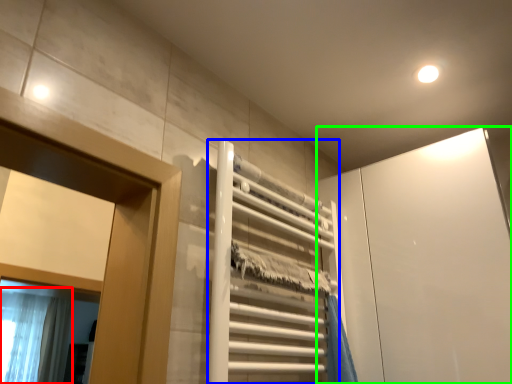
Question: Which is farther away from shower curtain (highlighted by a red box)? elevator (highlighted by a blue box) or screen door (highlighted by a green box)?

Choices:
 (A) elevator
 (B) screen door

Answer: (B)